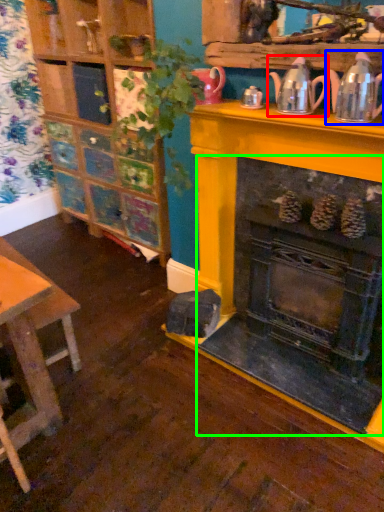
Question: Based on their relative distances, which object is nearer to tea pot (highlighted by a red box)? Choose from tea pot (highlighted by a blue box) and fireplace (highlighted by a green box).

Choices:
 (A) tea pot
 (B) fireplace

Answer: (A)